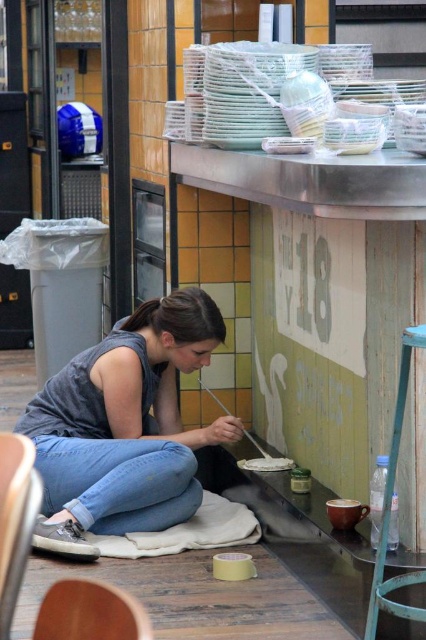
What do you see at coordinates (124, 428) in the screenshot?
I see `gray cotton shirt at center` at bounding box center [124, 428].

Who is shorter, gray cotton shirt at center or white matte paint at lower center?

white matte paint at lower center is shorter.

Is point (108, 417) behind point (290, 460)?

No, (108, 417) is in front of (290, 460).

The height and width of the screenshot is (640, 426). Identify the location of gray cotton shirt at center. (124, 428).